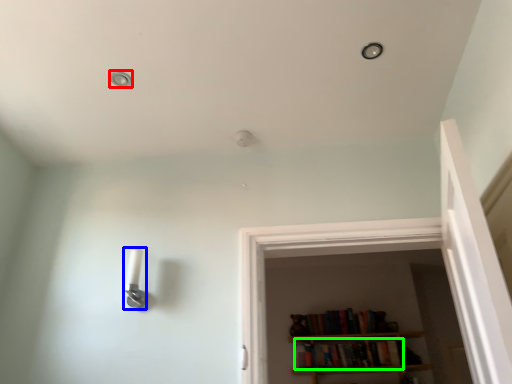
Question: Estimate the real-world distances between objects in this image. Which object is closer to dot (highlighted by a red box), light fixture (highlighted by a blue box) or book (highlighted by a green box)?

Choices:
 (A) light fixture
 (B) book

Answer: (A)